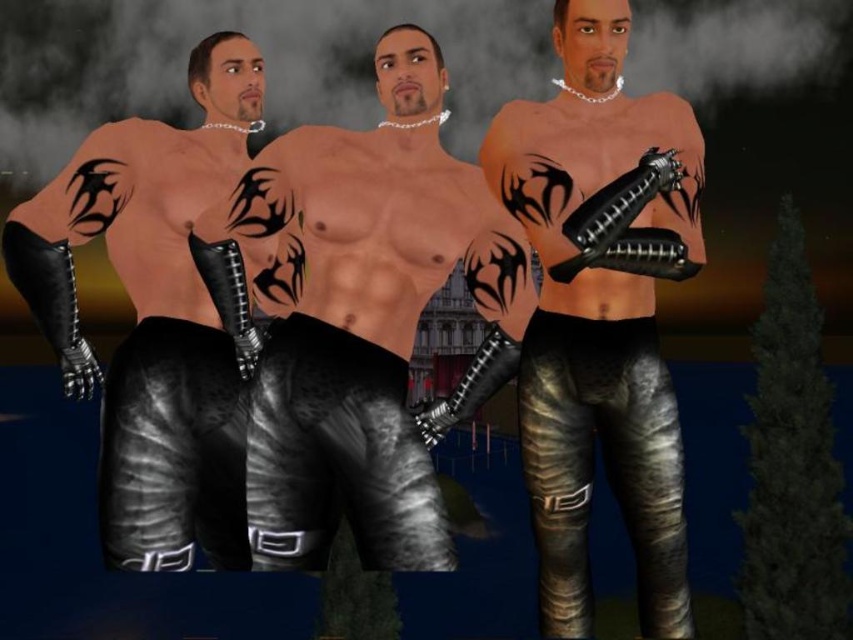
Question: Which object appears farthest from the camera in this image?

Choices:
 (A) shiny black leather pants at center
 (B) matte black leather pants at left
 (C) metallic black pants at center

Answer: (B)

Question: Can you confirm if shiny black leather pants at center is thinner than metallic black pants at center?

Choices:
 (A) yes
 (B) no

Answer: (B)

Question: Which of the following is the farthest from the observer?

Choices:
 (A) (136, 177)
 (B) (297, 316)
 (C) (532, 348)

Answer: (A)

Question: Can you confirm if metallic black pants at center is thinner than matte black leather pants at left?

Choices:
 (A) yes
 (B) no

Answer: (A)

Question: Which object is the closest to the matte black leather pants at left?

Choices:
 (A) shiny black leather pants at center
 (B) metallic black pants at center

Answer: (A)

Question: Is the position of shiny black leather pants at center less distant than that of metallic black pants at center?

Choices:
 (A) no
 (B) yes

Answer: (A)